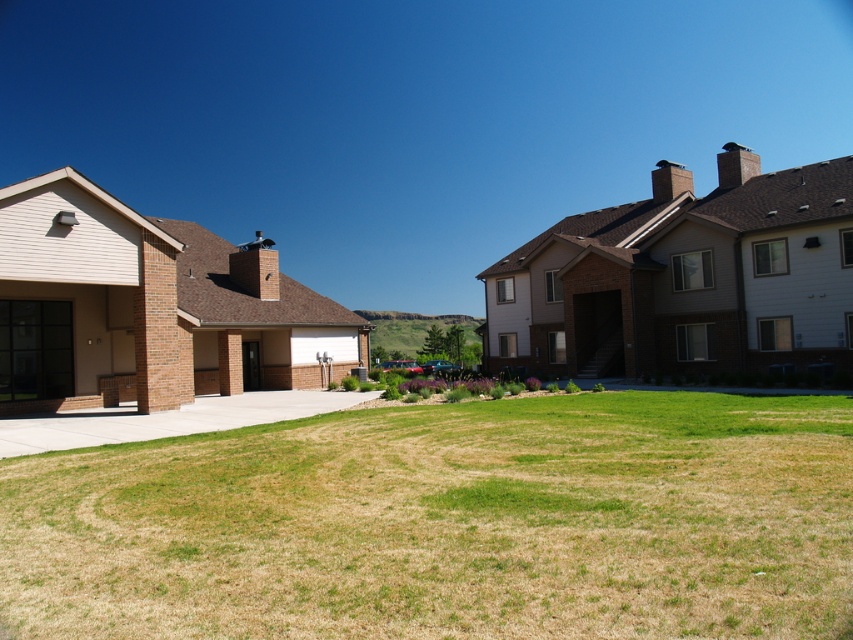
You are standing in the residential area and want to walk from the green grass at center to the brown wood garage at right. Which direction should you head?

You should head to the right because the green grass at center is to the left of the brown wood garage at right, so moving right will take you towards the garage.

You are a delivery person trying to determine the best path to avoid the tallest object in the scene. Which object should you avoid? The beige brick garage at left or the concrete at center?

The beige brick garage at left is taller than the concrete at center, so you should avoid the beige brick garage at left.